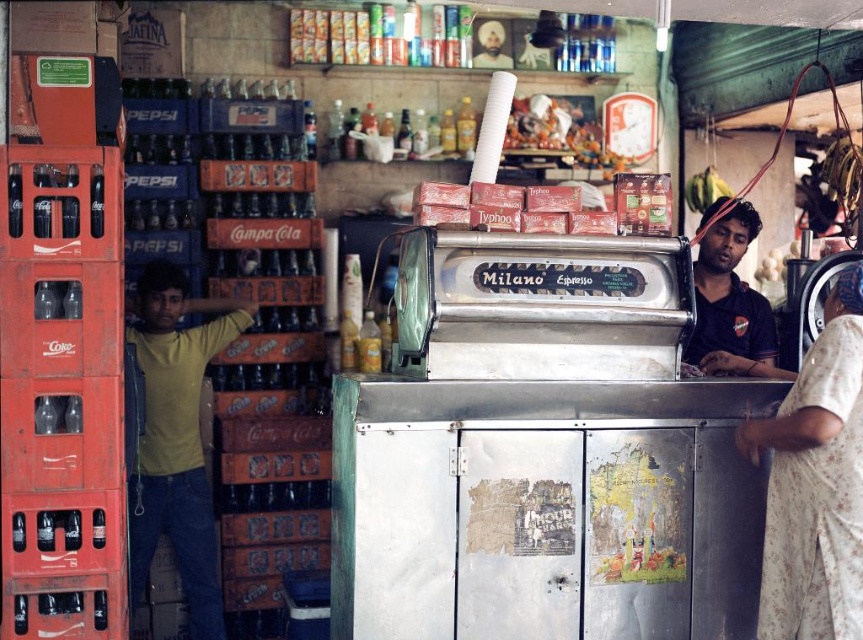
Which is above, floral fabric dress at right or dark blue shirt at right?

dark blue shirt at right is higher up.

Is point (843, 312) positioned behind point (770, 352)?

No.

Locate an element on the screen. Image resolution: width=863 pixels, height=640 pixels. floral fabric dress at right is located at coordinates (816, 483).

Can you confirm if yellow t-shirt at left is taller than dark blue shirt at right?

Yes, yellow t-shirt at left is taller than dark blue shirt at right.

Who is more forward, (198, 352) or (744, 317)?

Point (744, 317)

Image resolution: width=863 pixels, height=640 pixels. I want to click on yellow t-shirt at left, so (177, 436).

Does floral fabric dress at right have a smaller size compared to yellow t-shirt at left?

Indeed, floral fabric dress at right has a smaller size compared to yellow t-shirt at left.

Who is taller, floral fabric dress at right or yellow t-shirt at left?

yellow t-shirt at left

Is point (835, 600) less distant than point (154, 323)?

Yes.

The height and width of the screenshot is (640, 863). In order to click on floral fabric dress at right in this screenshot , I will do `click(816, 483)`.